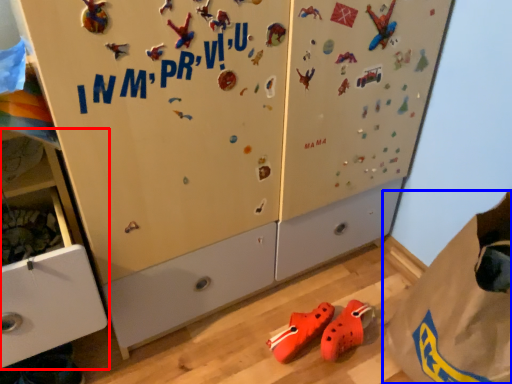
Question: Which of the following is the farthest to the observer, cabinetry (highlighted by a red box) or paper bag (highlighted by a blue box)?

Choices:
 (A) cabinetry
 (B) paper bag

Answer: (B)